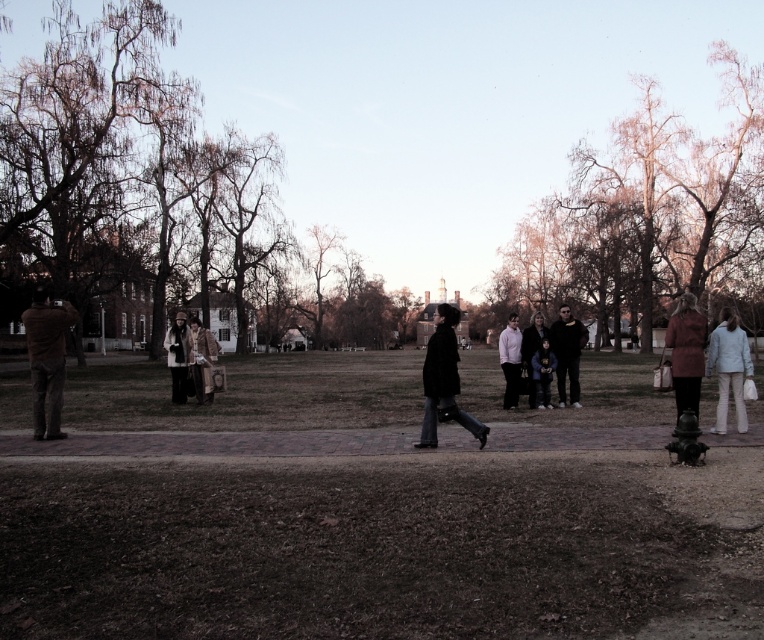
Question: Can you confirm if brown leather jacket at center is positioned to the left of dark blue coat at center?

Choices:
 (A) yes
 (B) no

Answer: (A)

Question: Is matte black coat at center above brown leather jacket at center?

Choices:
 (A) yes
 (B) no

Answer: (A)

Question: Is the position of brown grass at center less distant than that of light blue fabric coat at right?

Choices:
 (A) yes
 (B) no

Answer: (A)

Question: Estimate the real-world distances between objects in this image. Which object is closer to the white textured coat at center?

Choices:
 (A) matte black coat at center
 (B) white matte shirt at center
 (C) matte brown coat at right
 (D) brown leather jacket at center

Answer: (D)

Question: Which point is closer to the camera?

Choices:
 (A) (261, 440)
 (B) (497, 349)
 (C) (698, 387)

Answer: (C)

Question: Among these points, which one is farthest from the camera?

Choices:
 (A) (542, 337)
 (B) (504, 371)
 (C) (481, 428)

Answer: (B)